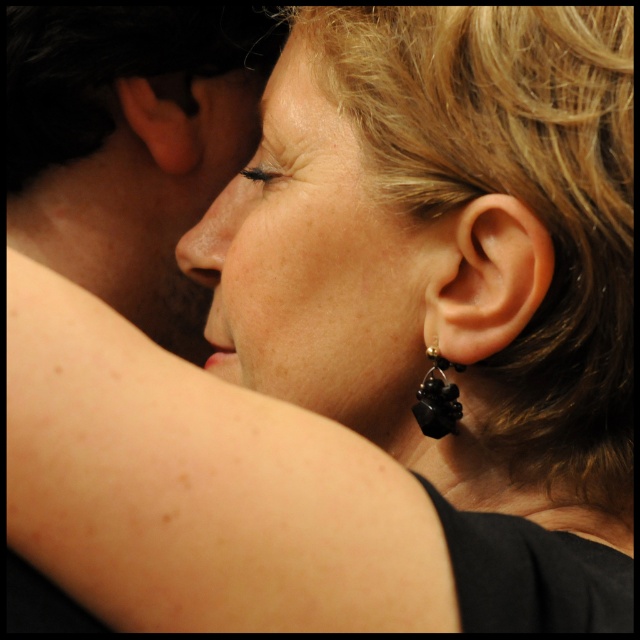
Is smooth skin face at center bigger than satin black earring at right?

Yes.

Is point (304, 388) farther from camera compared to point (483, 288)?

Yes, it is.

Is point (288, 120) positioned in front of point (484, 317)?

No, (288, 120) is further to viewer.

Find the location of a particular element. This screenshot has height=640, width=640. smooth skin face at center is located at coordinates (312, 262).

Measure the distance between point (456, 156) and camera.

Point (456, 156) and camera are 22.86 inches apart from each other.

Between point (604, 384) and point (468, 346), which one is positioned behind?

The point (468, 346) is more distant.

Where is `blonde curly hair at upper right`? blonde curly hair at upper right is located at coordinates (516, 198).

Between satin black earring at right and matte skin nose at center, which one is positioned higher?

Positioned higher is matte skin nose at center.

The width and height of the screenshot is (640, 640). I want to click on satin black earring at right, so click(x=483, y=276).

Does point (435, 288) lie in front of point (204, 268)?

Yes, it is.

Find the location of a particular element. satin black earring at right is located at coordinates (483, 276).